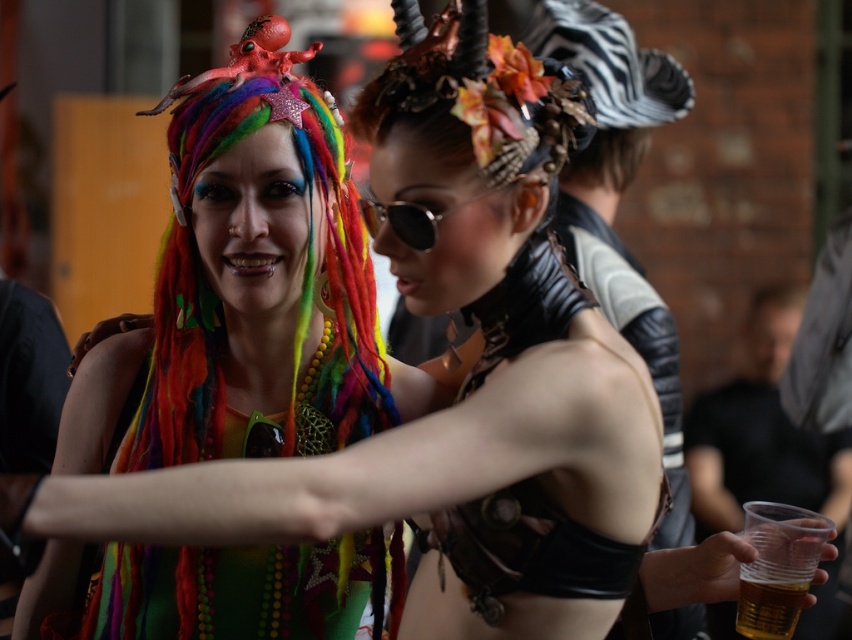
Question: Estimate the real-world distances between objects in this image. Which object is closer to the brown matte hair at center?

Choices:
 (A) translucent plastic cup at lower right
 (B) rainbow fabric headdress at upper left

Answer: (B)

Question: Where is brown matte hair at center located in relation to translucent plastic cup at lower right in the image?

Choices:
 (A) right
 (B) left

Answer: (B)

Question: Estimate the real-world distances between objects in this image. Which object is closer to the brown matte hair at center?

Choices:
 (A) rainbow fabric headdress at upper left
 (B) translucent plastic cup at lower right

Answer: (A)

Question: Does brown matte hair at center appear under translucent plastic cup at lower right?

Choices:
 (A) no
 (B) yes

Answer: (A)

Question: Does rainbow fabric headdress at upper left have a smaller size compared to brown matte hair at center?

Choices:
 (A) yes
 (B) no

Answer: (B)

Question: Estimate the real-world distances between objects in this image. Which object is closer to the rainbow fabric headdress at upper left?

Choices:
 (A) translucent plastic cup at lower right
 (B) brown matte hair at center

Answer: (A)